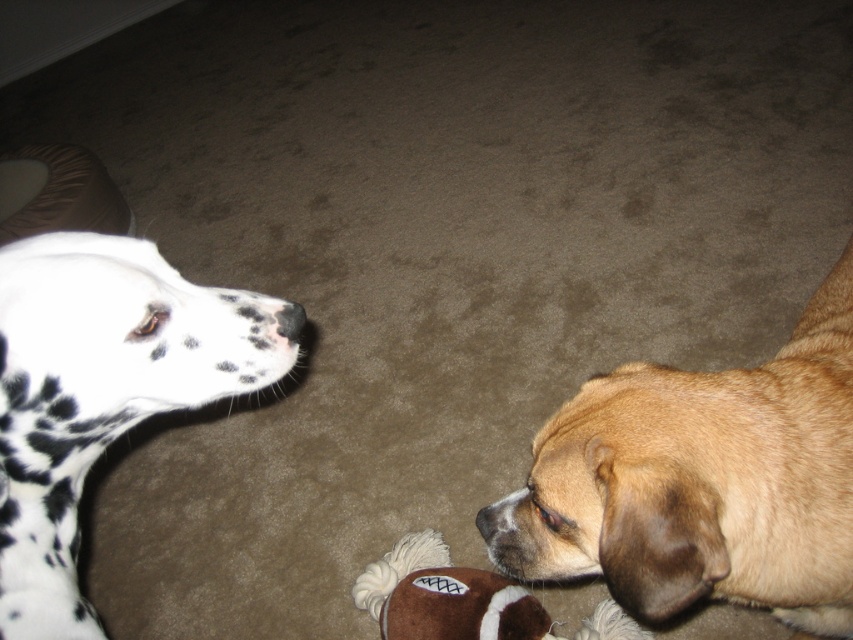
Does spotted fur dog at left appear on the right side of black matte nose at upper left?

In fact, spotted fur dog at left is to the left of black matte nose at upper left.

Does spotted fur dog at left have a smaller size compared to black matte nose at upper left?

Actually, spotted fur dog at left might be larger than black matte nose at upper left.

What do you see at coordinates (99, 392) in the screenshot? I see `spotted fur dog at left` at bounding box center [99, 392].

The image size is (853, 640). In order to click on spotted fur dog at left in this screenshot , I will do `click(99, 392)`.

Which is below, brown furry dog at lower right or black matte nose at upper left?

brown furry dog at lower right

Does point (807, 451) come in front of point (299, 314)?

Yes, point (807, 451) is in front of point (299, 314).

What do you see at coordinates (703, 481) in the screenshot?
I see `brown furry dog at lower right` at bounding box center [703, 481].

Find the location of a particular element. This screenshot has width=853, height=640. brown furry dog at lower right is located at coordinates [703, 481].

Does spotted fur dog at left appear over brown fuzzy nose at lower center?

Yes.

Does spotted fur dog at left appear under brown fuzzy nose at lower center?

No, spotted fur dog at left is not below brown fuzzy nose at lower center.

Does point (207, 372) come in front of point (479, 524)?

Yes, point (207, 372) is closer to viewer.

You are a GUI agent. You are given a task and a screenshot of the screen. Output one action in this format:
    pyautogui.click(x=<x>, y=<y>)
    Task: Click on the spotted fur dog at left
    
    Given the screenshot: What is the action you would take?
    pyautogui.click(x=99, y=392)